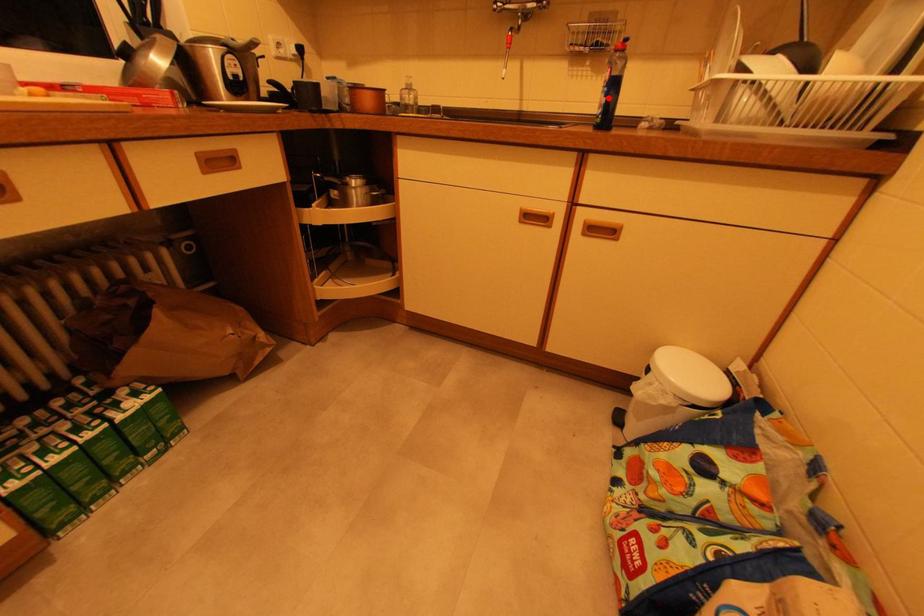
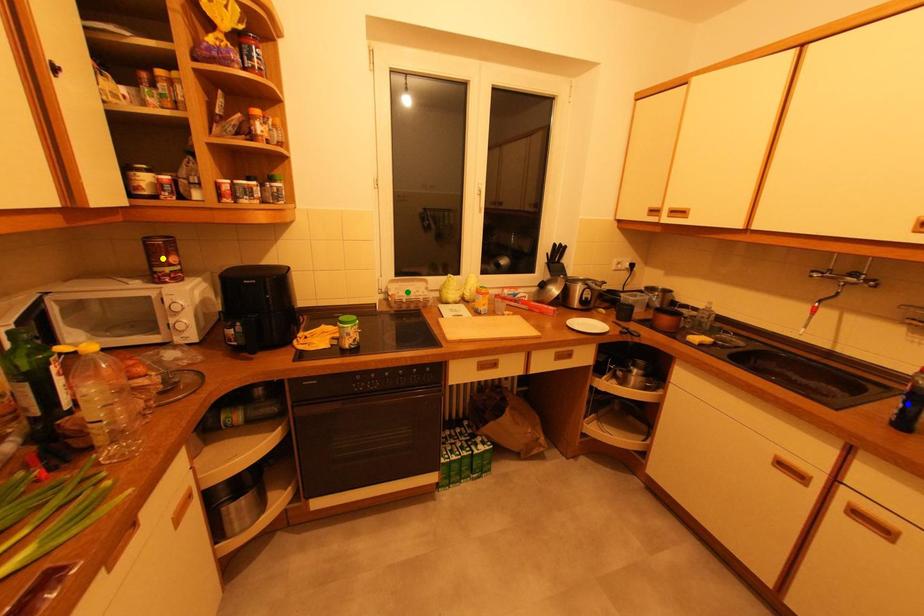
Question: I am providing you with two images of the same scene from different viewpoints. A red point is marked on the first image. You are given multiple points on the second image. In image 2, which mark is for the same physical point as the one in image 1?

Choices:
 (A) green point
 (B) blue point
 (C) yellow point

Answer: (B)